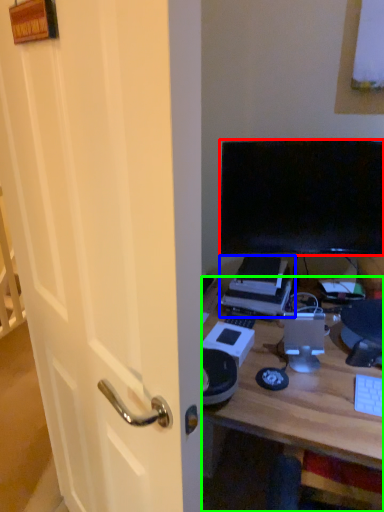
Question: Which is farther away from television (highlighted by a red box)? printer (highlighted by a blue box) or desk (highlighted by a green box)?

Choices:
 (A) printer
 (B) desk

Answer: (B)